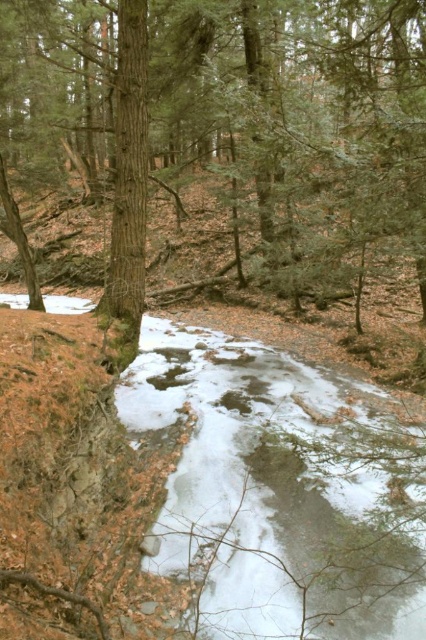
Who is higher up, brown wood tree at center or white frozen stream at center?

Positioned higher is brown wood tree at center.

Locate an element on the screen. This screenshot has width=426, height=640. brown wood tree at center is located at coordinates (299, 122).

Locate an element on the screen. This screenshot has width=426, height=640. brown wood tree at center is located at coordinates (299, 122).